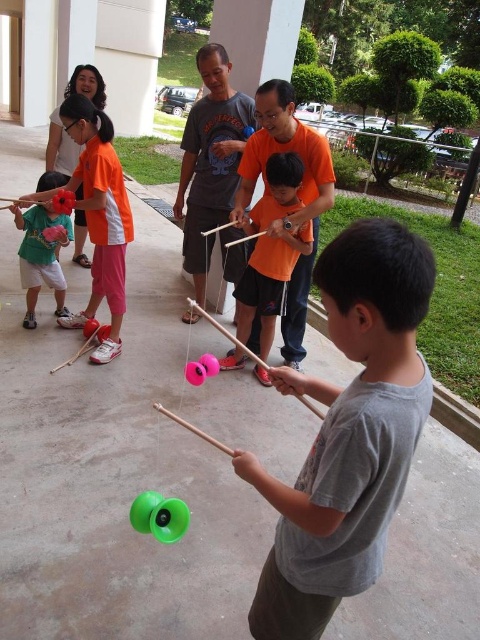
Question: Which point is farther to the camera?

Choices:
 (A) (287, 259)
 (B) (72, 237)
 (C) (213, 371)
 (D) (298, 628)

Answer: (B)

Question: Can you confirm if orange cotton shirt at upper left is smaller than pink rubber yo-yo at center?

Choices:
 (A) yes
 (B) no

Answer: (B)

Question: Which point appears farthest from the camera in this image?

Choices:
 (A) (58, 275)
 (B) (57, 196)
 (C) (176, 520)

Answer: (A)

Question: Does orange cotton shirt at upper left appear on the left side of orange matte/yarn at center?

Choices:
 (A) no
 (B) yes

Answer: (B)

Question: Which point is farther to the camera?

Choices:
 (A) pink rubber yo-yo at center
 (B) gray matte shirt at center

Answer: (A)

Question: Does gray matte shirt at center appear under green rubber yo-yo at lower center?

Choices:
 (A) no
 (B) yes

Answer: (A)